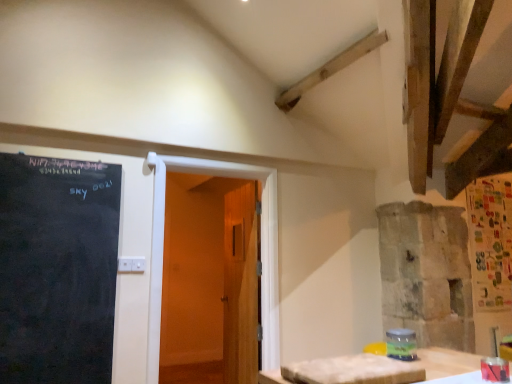
Question: Can you confirm if wooden door at center, acting as the second door starting from the front, is thinner than white textured table at lower right?

Choices:
 (A) no
 (B) yes

Answer: (A)

Question: Can you confirm if wooden door at center, acting as the second door starting from the front, is bigger than white textured table at lower right?

Choices:
 (A) no
 (B) yes

Answer: (B)

Question: Does wooden door at center, acting as the second door starting from the front, have a lesser height compared to white textured table at lower right?

Choices:
 (A) yes
 (B) no

Answer: (B)

Question: From the image's perspective, is wooden door at center, the first door when ordered from back to front, located beneath white textured table at lower right?

Choices:
 (A) yes
 (B) no

Answer: (A)

Question: From a real-world perspective, is wooden door at center, acting as the second door starting from the front, physically above white textured table at lower right?

Choices:
 (A) yes
 (B) no

Answer: (A)

Question: Is white textured table at lower right at the back of wooden door at center, the first door when ordered from back to front?

Choices:
 (A) no
 (B) yes

Answer: (A)

Question: Is white textured table at lower right in contact with blackboard at left?

Choices:
 (A) yes
 (B) no

Answer: (B)

Question: From a real-world perspective, does white textured table at lower right stand above blackboard at left?

Choices:
 (A) no
 (B) yes

Answer: (A)

Question: Can you confirm if white textured table at lower right is shorter than blackboard at left?

Choices:
 (A) no
 (B) yes

Answer: (B)

Question: Could you tell me if white textured table at lower right is facing blackboard at left?

Choices:
 (A) yes
 (B) no

Answer: (B)

Question: Does white textured table at lower right come in front of blackboard at left?

Choices:
 (A) yes
 (B) no

Answer: (A)

Question: Can you confirm if white textured table at lower right is wider than blackboard at left?

Choices:
 (A) no
 (B) yes

Answer: (B)

Question: Is blackboard at left positioned with its back to wooden door at center, which ranks as the second door in back-to-front order?

Choices:
 (A) no
 (B) yes

Answer: (A)